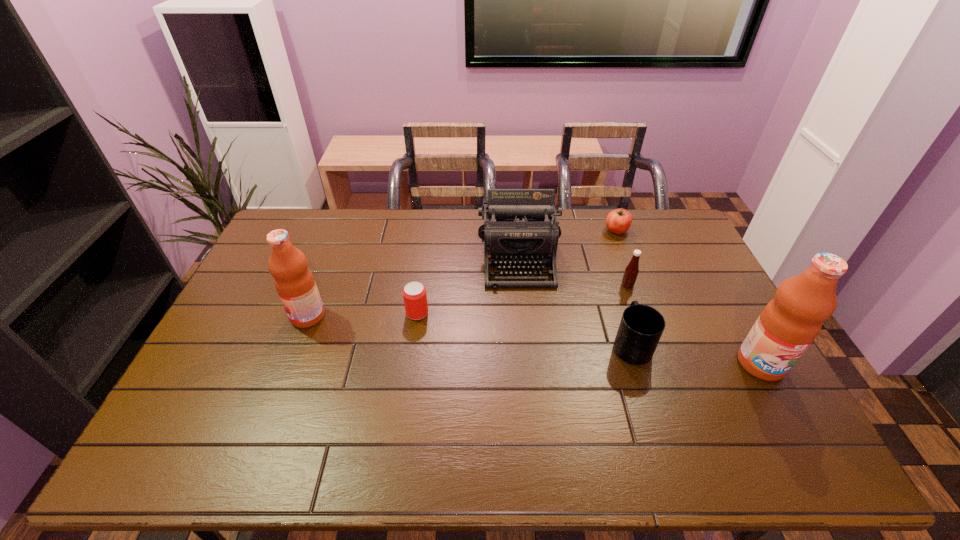
Identify the location of free region located on the front label of the left fruit juice. (x=238, y=316).

Locate an element on the screen. The width and height of the screenshot is (960, 540). vacant region located 0.050m on the front label of the left fruit juice is located at coordinates [x=275, y=316].

Where is `vacant space situated on the front label of the left fruit juice`? vacant space situated on the front label of the left fruit juice is located at coordinates (252, 316).

Locate an element on the screen. This screenshot has height=540, width=960. vacant region located 0.080m on the front label of the nearer fruit juice is located at coordinates (787, 410).

This screenshot has height=540, width=960. Find the location of `vacant space located 0.110m on the front of the apple`. vacant space located 0.110m on the front of the apple is located at coordinates (626, 256).

You are a GUI agent. You are given a task and a screenshot of the screen. Output one action in this format:
    pyautogui.click(x=<x>, y=<y>)
    Task: Click on the vacant region located 0.270m on the keyboard of the fifth shortest object
    The height and width of the screenshot is (540, 960).
    Given the screenshot: What is the action you would take?
    pyautogui.click(x=528, y=359)

Identify the location of free space located 0.200m on the side of the mug with the handle. (611, 280).

Identify the location of vacant point located on the side of the mug with the handle. (612, 282).

I want to click on free space located 0.060m on the side of the mug with the handle, so click(620, 312).

Find the location of a particular element. This screenshot has height=540, width=960. vacant space situated on the right of the second object from left to right is located at coordinates (447, 313).